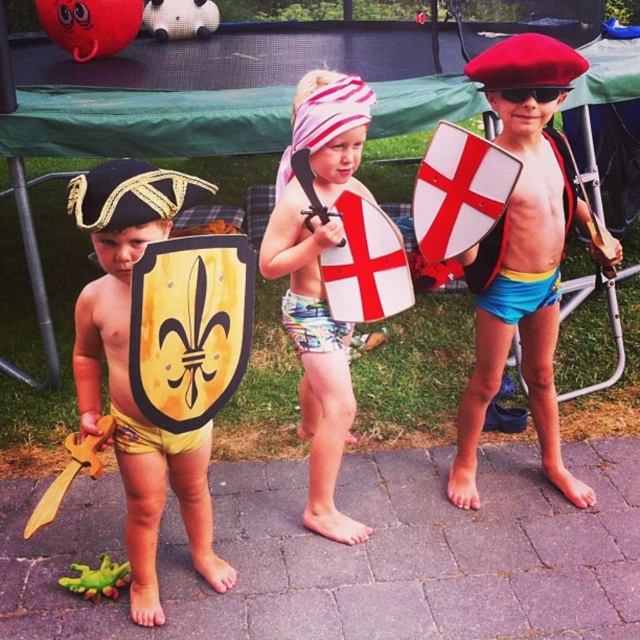
Question: Which of the following is the farthest from the observer?

Choices:
 (A) yellow fabric shield at left
 (B) black plastic goggles at center
 (C) printed fabric diaper at center
 (D) yellow printed diaper at center

Answer: (C)

Question: Estimate the real-world distances between objects in this image. Which object is farther from the yellow printed diaper at center?

Choices:
 (A) yellow fabric shield at left
 (B) black plastic goggles at center
 (C) red matte beret at upper right
 (D) blue fabric diaper at center

Answer: (B)

Question: Does yellow fabric shield at left appear on the right side of matte yellow shield at center?

Choices:
 (A) yes
 (B) no

Answer: (B)

Question: Can you confirm if matte yellow shield at center is positioned above black plastic goggles at center?

Choices:
 (A) yes
 (B) no

Answer: (B)

Question: Can you confirm if yellow fabric shield at left is positioned to the left of matte yellow shield at center?

Choices:
 (A) yes
 (B) no

Answer: (A)

Question: Which point appears closest to the camera in this image?

Choices:
 (A) (118, 428)
 (B) (516, 93)
 (C) (557, 253)

Answer: (A)